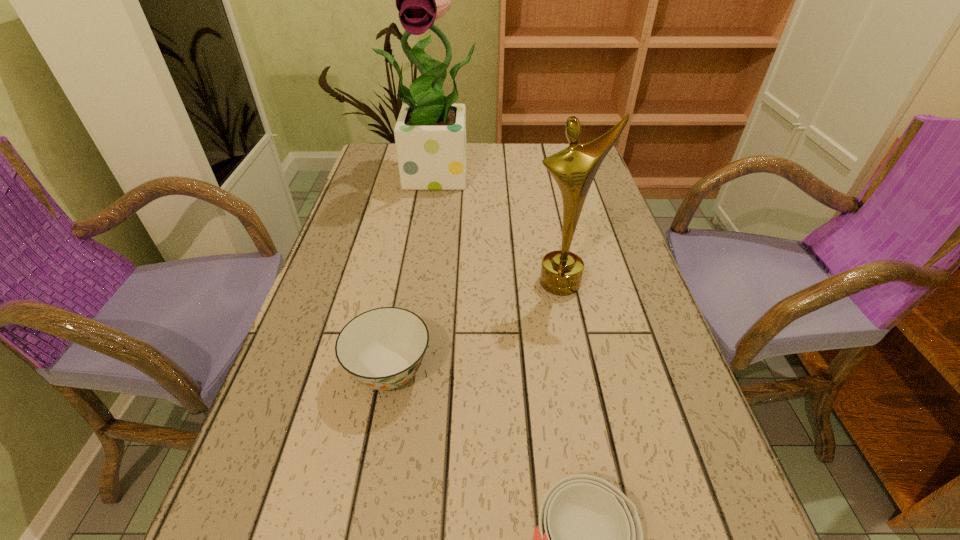
Identify the location of flower arrangement present at the left edge. This screenshot has height=540, width=960. (430, 133).

Locate an element on the screen. The width and height of the screenshot is (960, 540). soup bowl present at the left edge is located at coordinates (382, 348).

Locate an element on the screen. The width and height of the screenshot is (960, 540). object that is at the right edge is located at coordinates [x=574, y=168].

The height and width of the screenshot is (540, 960). I want to click on object that is positioned at the far left corner, so point(430,133).

This screenshot has height=540, width=960. Find the location of `vacant region at the far edge`. vacant region at the far edge is located at coordinates (490, 143).

This screenshot has width=960, height=540. I want to click on vacant space at the left edge, so click(349, 245).

You are a GUI agent. You are given a task and a screenshot of the screen. Output one action in this format:
    pyautogui.click(x=<x>, y=<y>)
    Task: Click on the vacant region at the right edge of the desktop
    Image resolution: width=960 pixels, height=540 pixels.
    Given the screenshot: What is the action you would take?
    pyautogui.click(x=651, y=340)

Image resolution: width=960 pixels, height=540 pixels. In the image, there is a desktop. In order to click on free space at the far right corner in this screenshot , I will do `click(553, 153)`.

At what (x,y) coordinates should I click in order to perform the action: click on free spot between the award and the flower arrangement. Please return your answer as a coordinate pair (x, y). This screenshot has width=960, height=540. Looking at the image, I should click on (502, 228).

Where is `object that is the third closest to the award`? object that is the third closest to the award is located at coordinates (589, 539).